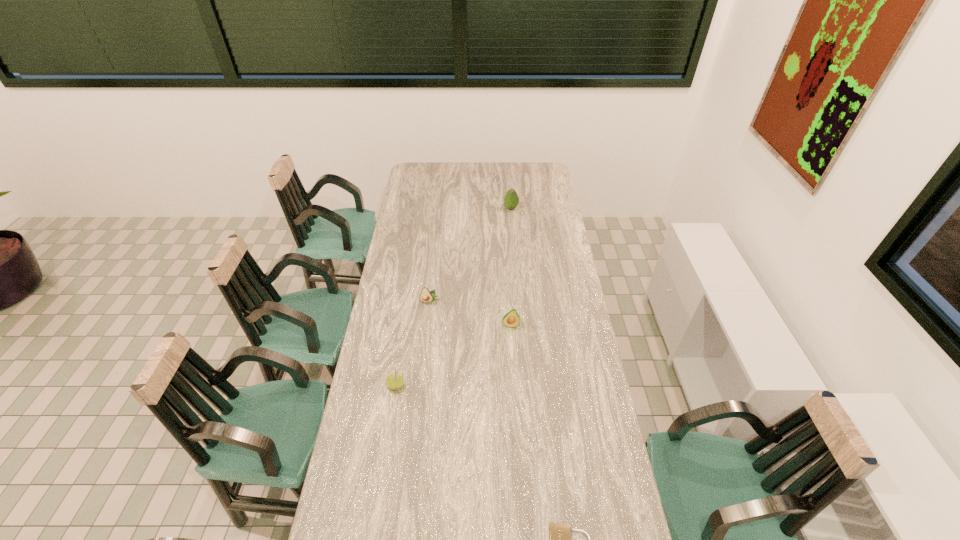
Locate which object ranks second in proximity to the farthest avocado. Please provide its 2D coordinates. Your answer should be formatted as a tuple, i.e. [(x, y)], where the tuple contains the x and y coordinates of a point satisfying the conditions above.

[(511, 319)]

Select which object is the fourth closest to the nearest avocado. Please provide its 2D coordinates. Your answer should be formatted as a tuple, i.e. [(x, y)], where the tuple contains the x and y coordinates of a point satisfying the conditions above.

[(511, 200)]

Find the location of a particular element. avocado that is the closest to the nearest object is located at coordinates (511, 319).

Locate an element on the screen. Image resolution: width=960 pixels, height=540 pixels. the second closest avocado to the leftmost avocado is located at coordinates (511, 200).